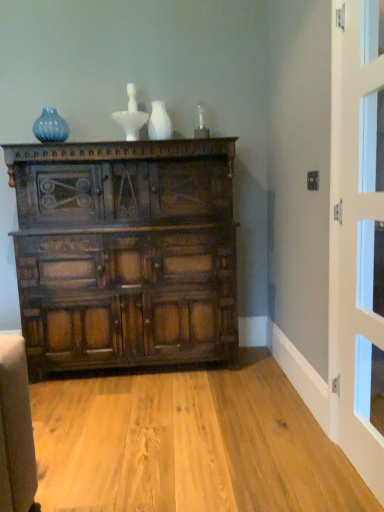
Question: Should I look upward or downward to see matte blue glass vase at upper left, placed as the 1th vase when sorted from left to right?

Choices:
 (A) down
 (B) up

Answer: (B)

Question: Is dark brown wood chest of drawers at center next to white glossy door at right?

Choices:
 (A) no
 (B) yes

Answer: (A)

Question: From a real-world perspective, does dark brown wood chest of drawers at center sit lower than white glossy door at right?

Choices:
 (A) yes
 (B) no

Answer: (A)

Question: Is dark brown wood chest of drawers at center shorter than white glossy door at right?

Choices:
 (A) no
 (B) yes

Answer: (B)

Question: Can you confirm if dark brown wood chest of drawers at center is thinner than white glossy door at right?

Choices:
 (A) no
 (B) yes

Answer: (A)

Question: Does dark brown wood chest of drawers at center have a larger size compared to white glossy door at right?

Choices:
 (A) yes
 (B) no

Answer: (A)

Question: Is dark brown wood chest of drawers at center to the left of white glossy door at right from the viewer's perspective?

Choices:
 (A) no
 (B) yes

Answer: (B)

Question: Is white glossy vase at upper center, which is the second vase from left to right, surrounded by matte blue glass vase at upper left, the second vase viewed from the front?

Choices:
 (A) yes
 (B) no

Answer: (B)

Question: Is matte blue glass vase at upper left, marked as the first vase in a back-to-front arrangement, at the right side of white glossy vase at upper center, the first vase positioned from the right?

Choices:
 (A) yes
 (B) no

Answer: (B)

Question: From a real-world perspective, is matte blue glass vase at upper left, placed as the 1th vase when sorted from left to right, located beneath white glossy vase at upper center, the first vase positioned from the front?

Choices:
 (A) yes
 (B) no

Answer: (B)

Question: Could you tell me if matte blue glass vase at upper left, the second vase viewed from the front, is turned towards white glossy vase at upper center, which is the second vase from left to right?

Choices:
 (A) no
 (B) yes

Answer: (A)

Question: Is matte blue glass vase at upper left, placed as the 1th vase when sorted from left to right, positioned with its back to white glossy vase at upper center, which is the second vase from left to right?

Choices:
 (A) no
 (B) yes

Answer: (A)

Question: From the image's perspective, is matte blue glass vase at upper left, the second vase viewed from the front, beneath white glossy vase at upper center, which is the second vase from left to right?

Choices:
 (A) yes
 (B) no

Answer: (B)

Question: Are white glossy door at right and matte blue glass vase at upper left, the second vase viewed from the front, making contact?

Choices:
 (A) no
 (B) yes

Answer: (A)